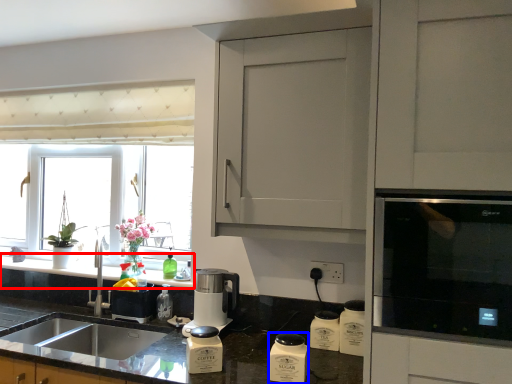
Question: Which object appears closest to the camera in this image, countertop (highlighted by a red box) or appliance (highlighted by a blue box)?

Choices:
 (A) countertop
 (B) appliance

Answer: (B)